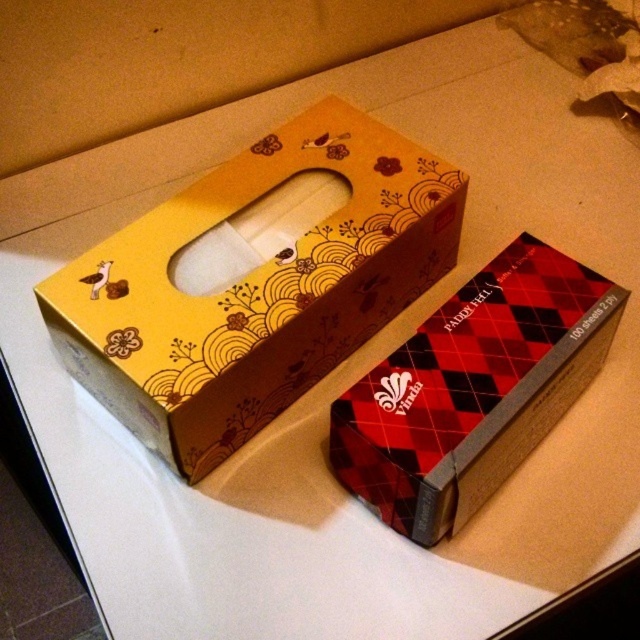
Which is in front, point (141, 416) or point (353, 476)?

Point (141, 416) is more forward.

Which of these two, matte brown tissue box at upper left or red argyle-patterned tissue box at center-right, stands taller?

With more height is matte brown tissue box at upper left.

Image resolution: width=640 pixels, height=640 pixels. What do you see at coordinates (253, 288) in the screenshot?
I see `matte brown tissue box at upper left` at bounding box center [253, 288].

This screenshot has height=640, width=640. What are the coordinates of `matte brown tissue box at upper left` in the screenshot? It's located at point(253,288).